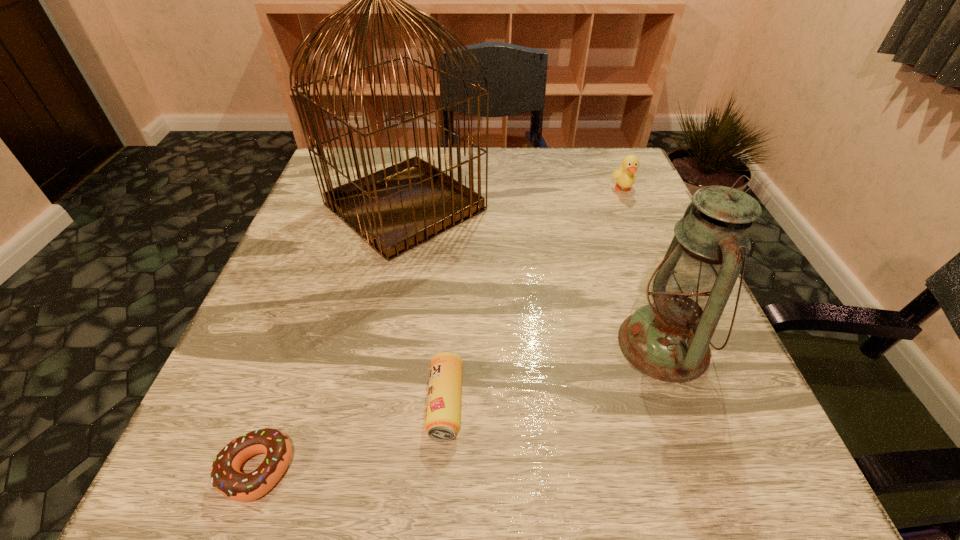
Locate an element on the screen. birdcage that is at the far edge is located at coordinates (395, 209).

The image size is (960, 540). I want to click on duckling located at the far edge, so click(x=625, y=176).

What are the coordinates of `beer can located in the near edge section of the desktop` in the screenshot? It's located at (443, 410).

This screenshot has width=960, height=540. Identify the location of doughnut located at the near edge. (226, 477).

This screenshot has height=540, width=960. Identify the location of birdcage present at the left edge. (395, 209).

The height and width of the screenshot is (540, 960). Find the location of `doughnut that is at the left edge`. doughnut that is at the left edge is located at coordinates (226, 477).

Image resolution: width=960 pixels, height=540 pixels. I want to click on oil lamp present at the right edge, so click(x=668, y=339).

The height and width of the screenshot is (540, 960). In order to click on duckling present at the right edge in this screenshot , I will do `click(625, 176)`.

Identify the location of object located in the far left corner section of the desktop. The height and width of the screenshot is (540, 960). (395, 209).

This screenshot has height=540, width=960. I want to click on object that is at the near left corner, so click(x=226, y=477).